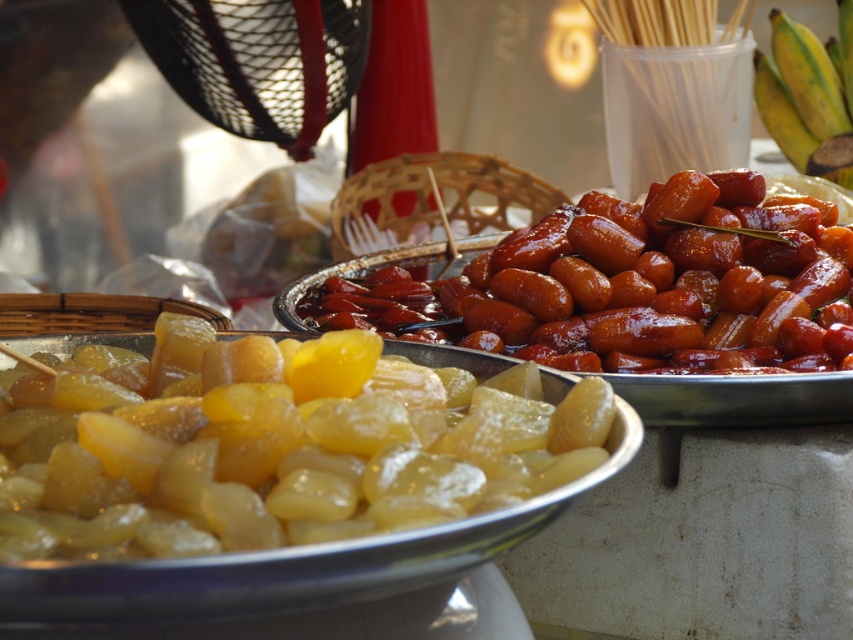
Which of these two, translucent yellow gummy at center or shiny brown sausages at center, stands taller?

shiny brown sausages at center

Is translucent yellow gummy at center shorter than shiny brown sausages at center?

Yes.

At what (x,y) coordinates should I click in order to perform the action: click on translucent yellow gummy at center. Please return your answer as a coordinate pair (x, y). This screenshot has width=853, height=640. Looking at the image, I should click on (283, 449).

Find the location of a particular element. The height and width of the screenshot is (640, 853). translucent yellow gummy at center is located at coordinates (283, 449).